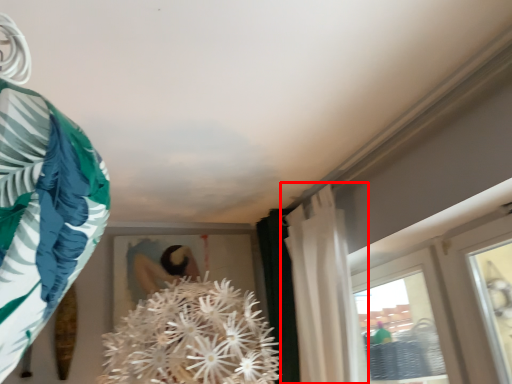
Question: From the image's perspective, what is the correct spatial relationship of curtain (annotated by the red box) in relation to clothing?

Choices:
 (A) below
 (B) above

Answer: (A)